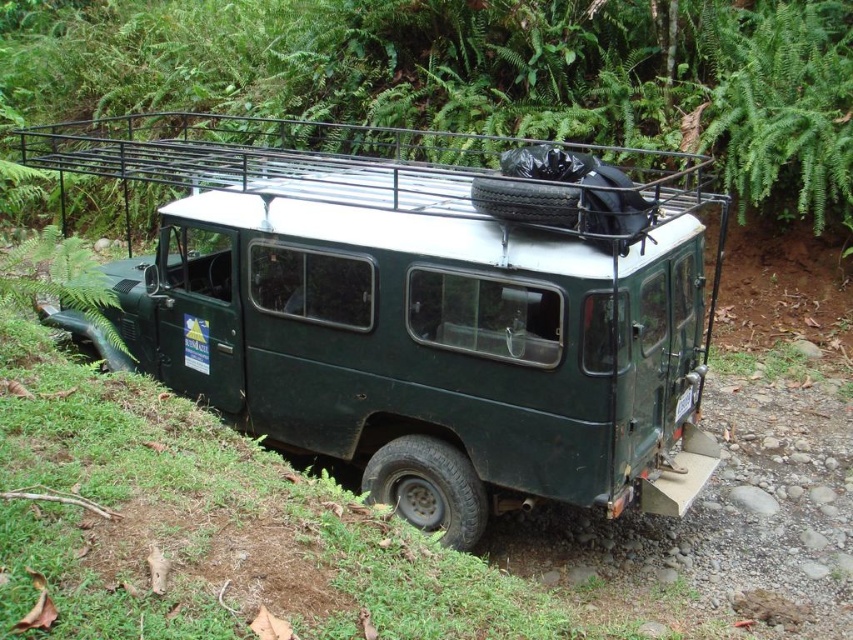
Question: Does green matte jeep at center have a lesser width compared to green leafy vegetation at upper center?

Choices:
 (A) yes
 (B) no

Answer: (A)

Question: Estimate the real-world distances between objects in this image. Which object is closer to the green leafy vegetation at upper center?

Choices:
 (A) green matte jeep at center
 (B) black metal rack at upper center

Answer: (B)

Question: Which point appears closest to the camera in this image?

Choices:
 (A) (554, 83)
 (B) (511, 198)

Answer: (B)

Question: Can you confirm if green matte jeep at center is smaller than green leafy vegetation at upper center?

Choices:
 (A) yes
 (B) no

Answer: (A)

Question: Which is nearer to the green matte jeep at center?

Choices:
 (A) black metal rack at upper center
 (B) green leafy vegetation at upper center

Answer: (A)

Question: Is green matte jeep at center below black metal rack at upper center?

Choices:
 (A) yes
 (B) no

Answer: (A)